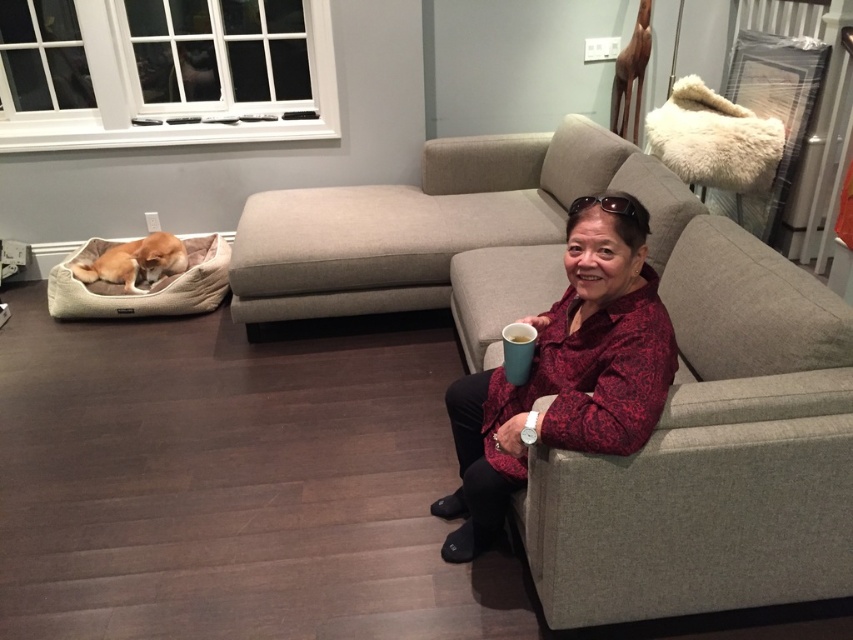
Which is behind, point (57, 278) or point (83, 278)?

The point (83, 278) is more distant.

Can you confirm if beige fabric dog bed at lower left is taller than light brown plush dog at left?

Correct, beige fabric dog bed at lower left is much taller as light brown plush dog at left.

You are a GUI agent. You are given a task and a screenshot of the screen. Output one action in this format:
    pyautogui.click(x=<x>, y=<y>)
    Task: Click on the beige fabric dog bed at lower left
    Image resolution: width=853 pixels, height=640 pixels.
    Given the screenshot: What is the action you would take?
    pyautogui.click(x=143, y=285)

Does matte gray couch at center lie in front of matte red blouse at center?

No, matte gray couch at center is behind matte red blouse at center.

Between matte gray couch at center and matte red blouse at center, which one appears on the left side from the viewer's perspective?

matte gray couch at center is more to the left.

Between point (811, 387) and point (509, 474), which one is positioned in front?

Positioned in front is point (811, 387).

The height and width of the screenshot is (640, 853). Find the location of `matte gray couch at center`. matte gray couch at center is located at coordinates (669, 390).

Who is positioned more to the right, matte red blouse at center or light brown plush dog at left?

From the viewer's perspective, matte red blouse at center appears more on the right side.

Does point (634, 451) come farther from viewer compared to point (158, 260)?

That is False.

Locate an element on the screen. matte red blouse at center is located at coordinates [566, 372].